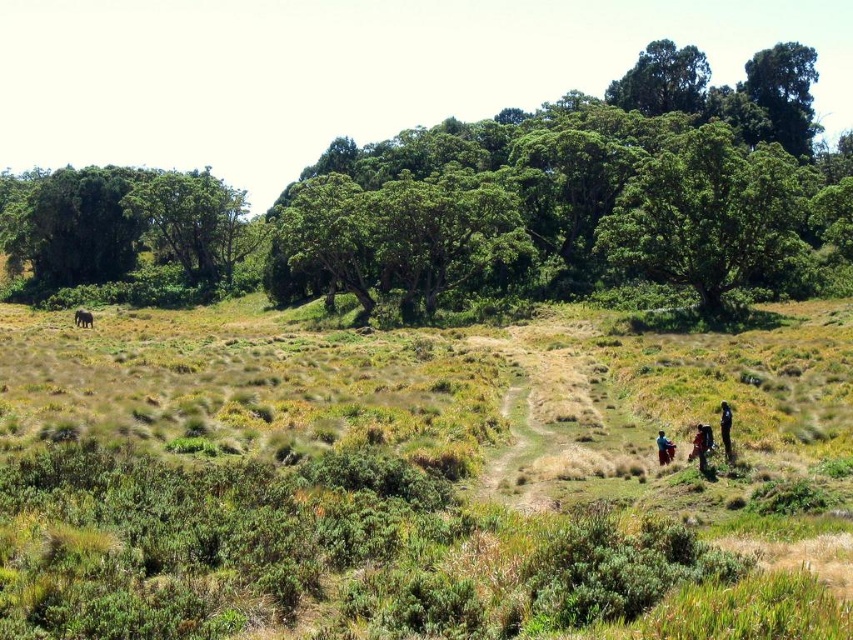
Question: Can you confirm if brown leather backpack at lower right is bigger than dark blue fabric at lower right?

Choices:
 (A) no
 (B) yes

Answer: (B)

Question: Among these objects, which one is farthest from the camera?

Choices:
 (A) blue fabric person at lower right
 (B) green leafy tree at upper right
 (C) multicolored fabric at lower right

Answer: (B)

Question: Which object is closer to the camera taking this photo?

Choices:
 (A) brown leather backpack at lower right
 (B) multicolored fabric at lower right
 (C) green grassy at center
 (D) blue fabric person at lower right

Answer: (C)

Question: Can you confirm if green grassy at center is positioned above green leafy tree at upper right?

Choices:
 (A) no
 (B) yes

Answer: (A)

Question: Does multicolored fabric at lower right come behind dark blue fabric at lower right?

Choices:
 (A) no
 (B) yes

Answer: (A)

Question: Estimate the real-world distances between objects in this image. Which object is closer to the brown leather backpack at lower right?

Choices:
 (A) blue fabric person at lower right
 (B) green leafy tree at upper right

Answer: (A)